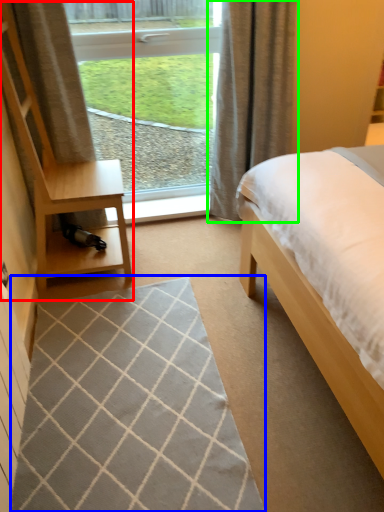
Question: Estimate the real-world distances between objects in this image. Which object is closer to dresser (highlighted by a red box), mat (highlighted by a blue box) or curtain (highlighted by a green box)?

Choices:
 (A) mat
 (B) curtain

Answer: (A)